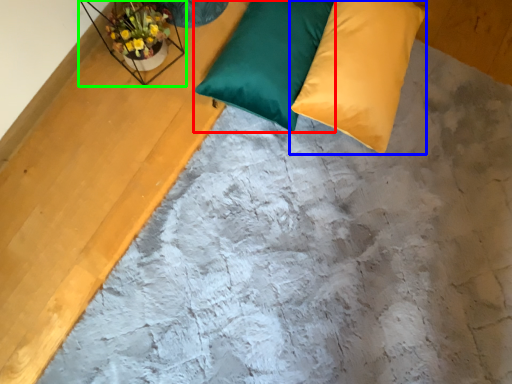
Question: Estimate the real-world distances between objects in this image. Which object is closer to pillow (highlighted by a red box), pillow (highlighted by a blue box) or window sill (highlighted by a green box)?

Choices:
 (A) pillow
 (B) window sill

Answer: (A)